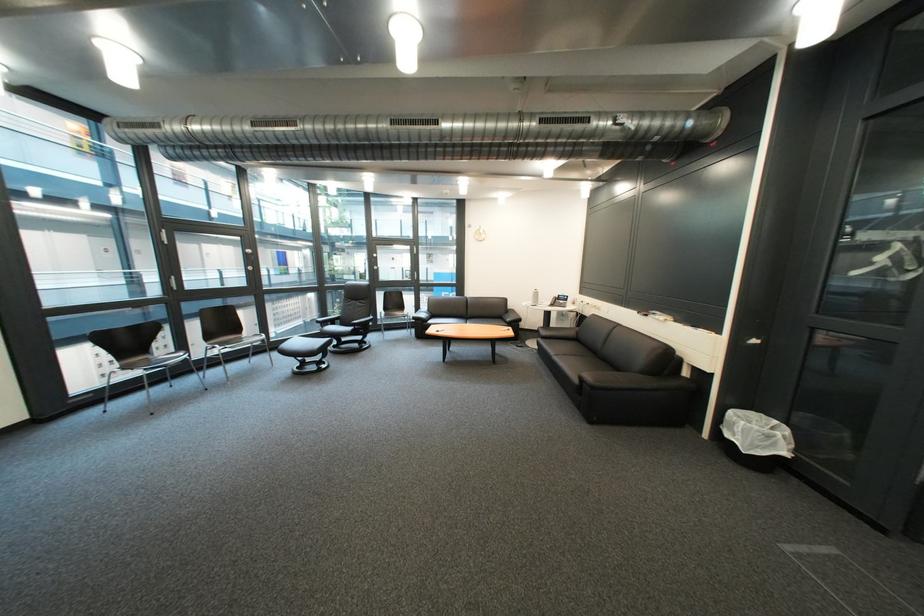
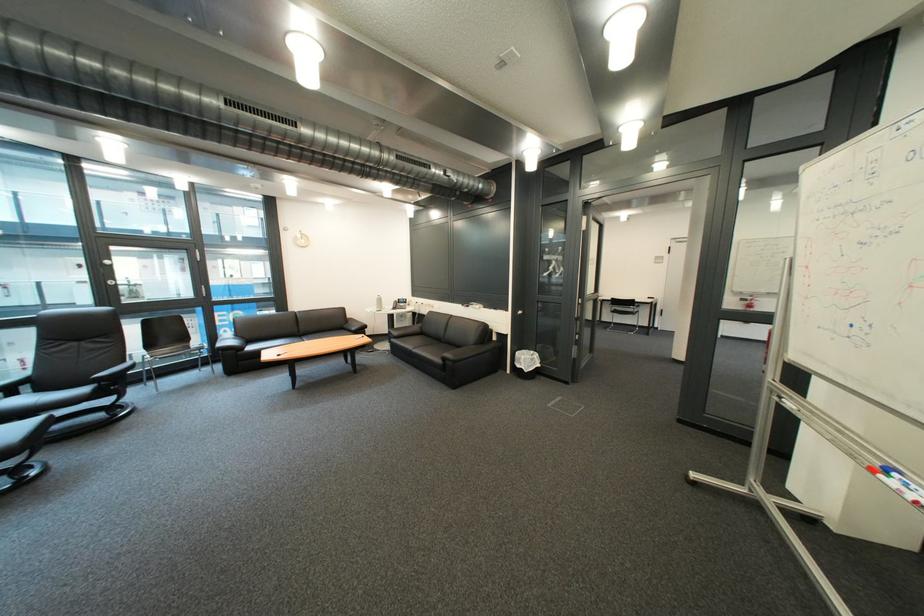
Locate, in the second image, the point that corresponds to the point at 734,334 in the first image.

(520, 312)